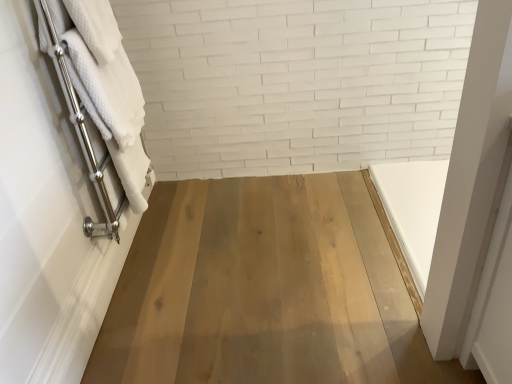
Question: Should I look upward or downward to see white textured towel at left, which appears as the 2th bath towel when ordered from the bottom?

Choices:
 (A) down
 (B) up

Answer: (B)

Question: From the image's perspective, is white textured towel at left, which appears as the 2th bath towel when ordered from the bottom, on white textured towel at left, the 1th bath towel positioned from the bottom?

Choices:
 (A) yes
 (B) no

Answer: (A)

Question: Can you confirm if white textured towel at left, which appears as the 2th bath towel when ordered from the bottom, is bigger than white textured towel at left, the 1th bath towel positioned from the bottom?

Choices:
 (A) yes
 (B) no

Answer: (B)

Question: From the image's perspective, is white textured towel at left, acting as the first bath towel starting from the top, beneath white textured towel at left, the 1th bath towel positioned from the bottom?

Choices:
 (A) yes
 (B) no

Answer: (B)

Question: Does white textured towel at left, which appears as the 2th bath towel when ordered from the bottom, appear on the right side of white textured towel at left, the 1th bath towel positioned from the bottom?

Choices:
 (A) yes
 (B) no

Answer: (A)

Question: Is white textured towel at left, acting as the first bath towel starting from the top, taller than white textured towel at left, placed as the second bath towel when sorted from top to bottom?

Choices:
 (A) yes
 (B) no

Answer: (B)

Question: Would you consider white textured towel at left, which appears as the 2th bath towel when ordered from the bottom, to be distant from white textured towel at left, placed as the second bath towel when sorted from top to bottom?

Choices:
 (A) yes
 (B) no

Answer: (B)

Question: Is white textured towel at left, the 1th bath towel positioned from the bottom, oriented away from white textured towel at left, acting as the first bath towel starting from the top?

Choices:
 (A) yes
 (B) no

Answer: (A)

Question: Are white textured towel at left, the 1th bath towel positioned from the bottom, and white textured towel at left, acting as the first bath towel starting from the top, located far from each other?

Choices:
 (A) yes
 (B) no

Answer: (B)

Question: From a real-world perspective, is white textured towel at left, the 1th bath towel positioned from the bottom, on white textured towel at left, acting as the first bath towel starting from the top?

Choices:
 (A) no
 (B) yes

Answer: (A)

Question: Is white textured towel at left, acting as the first bath towel starting from the top, located within white textured towel at left, the 1th bath towel positioned from the bottom?

Choices:
 (A) no
 (B) yes

Answer: (B)

Question: Is white textured towel at left, placed as the second bath towel when sorted from top to bottom, bigger than white textured towel at left, acting as the first bath towel starting from the top?

Choices:
 (A) no
 (B) yes

Answer: (B)

Question: Is white textured towel at left, the 1th bath towel positioned from the bottom, positioned in front of white textured towel at left, which appears as the 2th bath towel when ordered from the bottom?

Choices:
 (A) yes
 (B) no

Answer: (A)

Question: Considering their positions, is white textured towel at left, the 1th bath towel positioned from the bottom, located in front of or behind white textured towel at left, which appears as the 2th bath towel when ordered from the bottom?

Choices:
 (A) front
 (B) behind

Answer: (A)